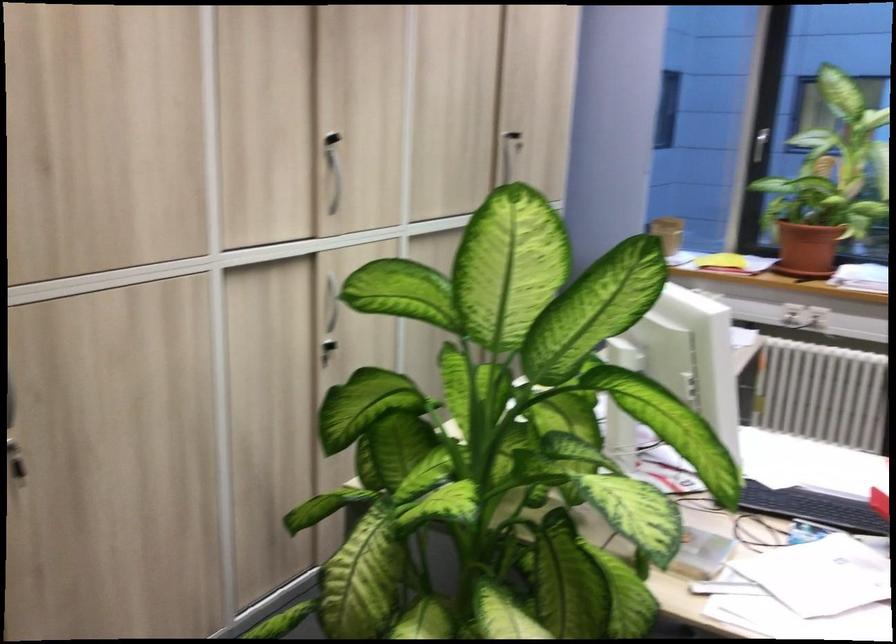
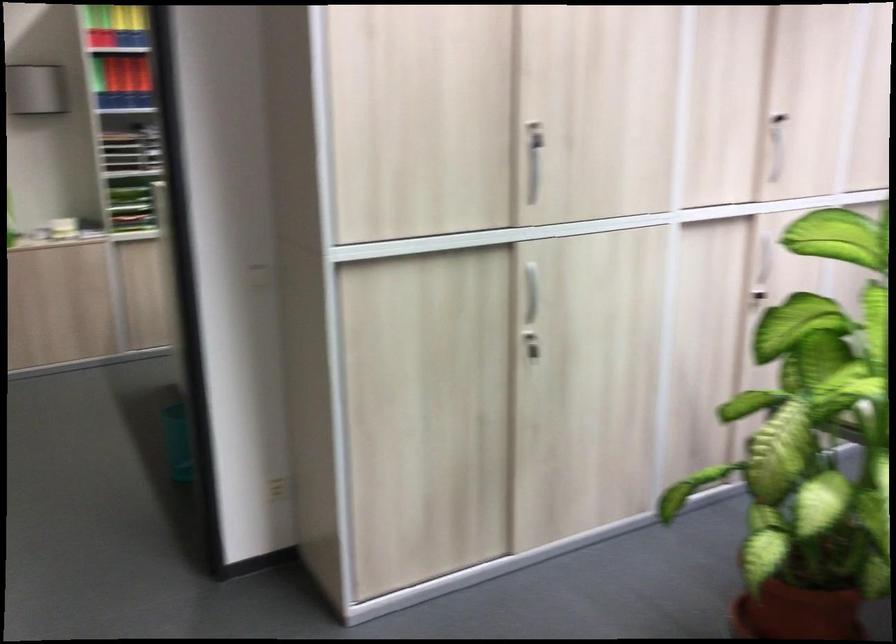
In the second image, find the point that corresponds to [336,346] in the first image.

(759, 299)